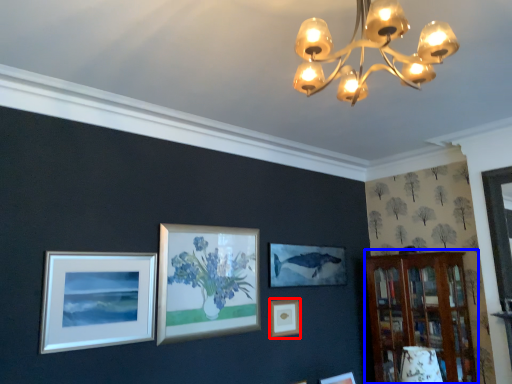
Question: Which point is closer to the camera, picture frame (highlighted by a red box) or bookshelf (highlighted by a blue box)?

Choices:
 (A) picture frame
 (B) bookshelf

Answer: (B)